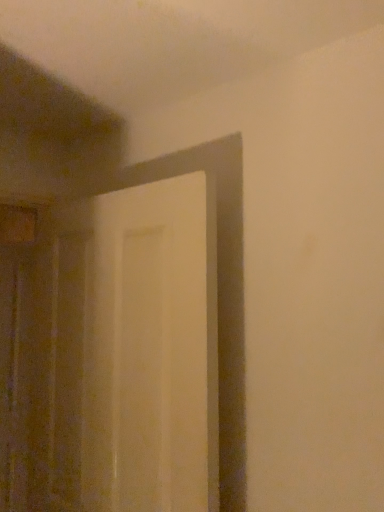
What do you see at coordinates (151, 351) in the screenshot? I see `white matte door at center` at bounding box center [151, 351].

Locate an element on the screen. The height and width of the screenshot is (512, 384). white matte door at center is located at coordinates (151, 351).

Measure the distance between white matte door at center and camera.

The depth of white matte door at center is 3.46 feet.

Locate an element on the screen. white matte door at center is located at coordinates (151, 351).